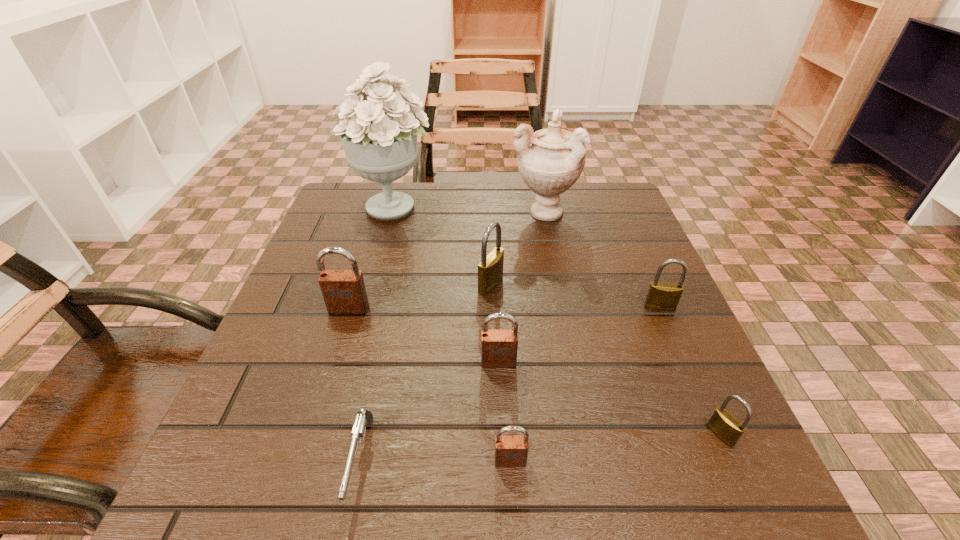
Identify the location of vacant point located between the second nearest brass padlock and the pistol. (510, 384).

You are a GUI agent. You are given a task and a screenshot of the screen. Output one action in this format:
    pyautogui.click(x=<x>, y=<y>)
    Task: Click on the free space between the smallest brass padlock and the farthest padlock
    The width and height of the screenshot is (960, 540).
    Given the screenshot: What is the action you would take?
    pyautogui.click(x=606, y=359)

The image size is (960, 540). What are the coordinates of `free point between the green bouquet and the pistol` in the screenshot? It's located at (376, 334).

This screenshot has width=960, height=540. I want to click on unoccupied area between the second biggest brass padlock and the second biggest brown padlock, so click(x=579, y=335).

At what (x,y) coordinates should I click in order to perform the action: click on free point between the nearest brown padlock and the biggest brass padlock. Please return your answer as a coordinate pair (x, y). This screenshot has width=960, height=540. Looking at the image, I should click on (500, 373).

The height and width of the screenshot is (540, 960). Find the location of `vacant space in between the farthest padlock and the nearest brown padlock`. vacant space in between the farthest padlock and the nearest brown padlock is located at coordinates (500, 373).

Find the location of a particular element. vacant area between the smallest brown padlock and the silver pistol is located at coordinates (436, 461).

Locate an element on the screen. Image resolution: width=960 pixels, height=540 pixels. free spot between the third object from right to left and the silver pistol is located at coordinates (451, 336).

Identify the location of free spot between the silver pistol and the second smallest brass padlock. (510, 384).

You are a GUI agent. You are given a task and a screenshot of the screen. Output one action in this format:
    pyautogui.click(x=<x>, y=<y>)
    Task: Click on the empty location between the pistol and the green bouquet
    This screenshot has width=960, height=540.
    Given the screenshot: What is the action you would take?
    pyautogui.click(x=376, y=334)